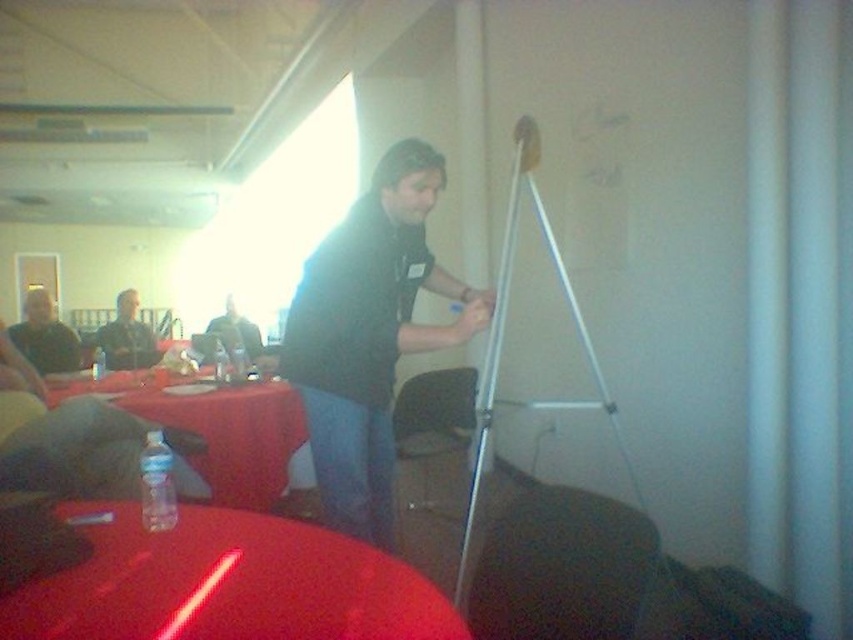
You are organizing a small event and need to place a decorative centerpiece on the table. The translucent plastic bottle at lower left and the metallic silver tripod at right are currently on the table. Which object should you move to make more space for the centerpiece?

The translucent plastic bottle at lower left occupies less space than the metallic silver tripod at right, so you should move the metallic silver tripod at right to make more space for the centerpiece.

You are standing in the room and see the point at coordinates (219, 429). What object is located at that point?

The point at coordinates (219, 429) corresponds to the translucent plastic bottle at lower left.

You are organizing a meeting in this room and need to place a new item on the table. The item requires a clear space not obscured by any objects. Given the current setup with the translucent plastic bottle at lower left and the matte black shirt at center, where should you place the item?

You should place the item on the table away from the translucent plastic bottle at lower left and the area under the matte black shirt at center, as the bottle is under the shirt and might block the space.